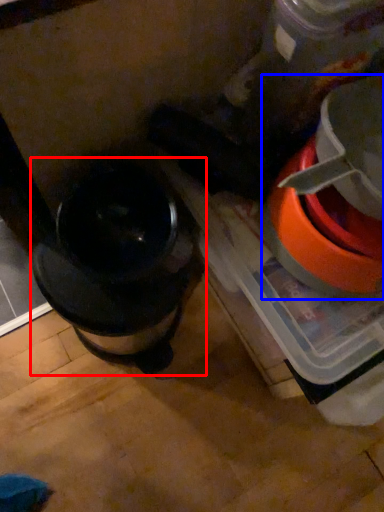
Question: Which object appears farthest to the camera in this image, kitchen appliance (highlighted by a red box) or appliance (highlighted by a blue box)?

Choices:
 (A) kitchen appliance
 (B) appliance

Answer: (A)